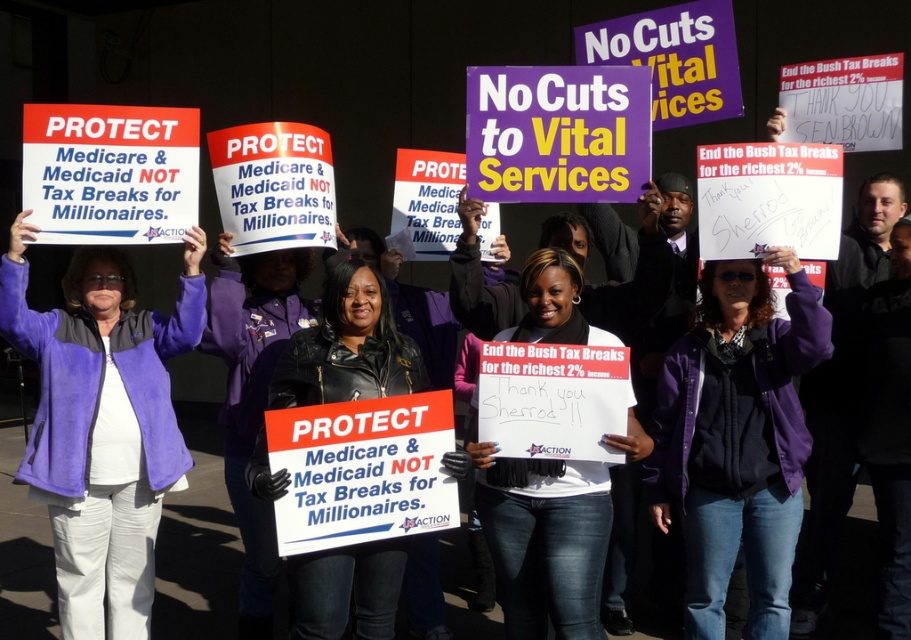
Question: Which of the following is the farthest from the observer?

Choices:
 (A) (374, 387)
 (B) (761, 577)
 (C) (135, 451)

Answer: (C)

Question: Which point appears closest to the camera in this image?

Choices:
 (A) (333, 307)
 (B) (243, 417)

Answer: (A)

Question: Does white matte sign at center lie behind black leather jacket at center?

Choices:
 (A) yes
 (B) no

Answer: (A)

Question: Can you confirm if white matte sign at center is thinner than matte purple jacket at center?

Choices:
 (A) no
 (B) yes

Answer: (A)

Question: Which of the following is the closest to the observer?

Choices:
 (A) black leather jacket at center
 (B) purple fleece jacket at left
 (C) white matte sign at center

Answer: (A)

Question: Is purple fleece jacket at left bigger than white matte sign at center?

Choices:
 (A) no
 (B) yes

Answer: (B)